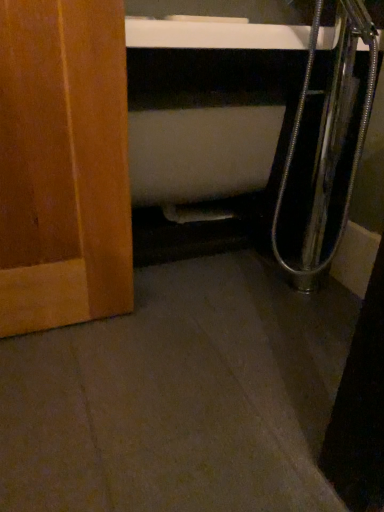
I want to click on vacant space underneath metallic silver showerhead at right (from a real-world perspective), so click(303, 294).